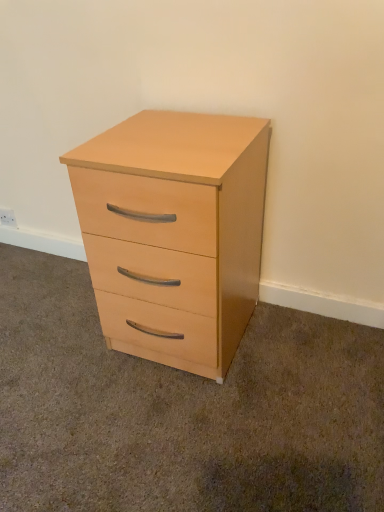
Find the location of a particular element. vacant space that is to the left of light wood/finish chest of drawers at center is located at coordinates (56, 338).